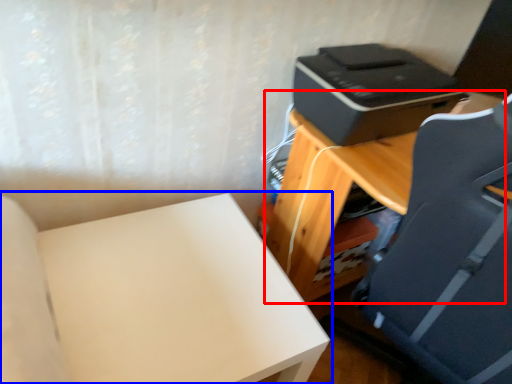
Question: Which of the following is the closest to the observer, table (highlighted by a red box) or furniture (highlighted by a blue box)?

Choices:
 (A) table
 (B) furniture

Answer: (A)